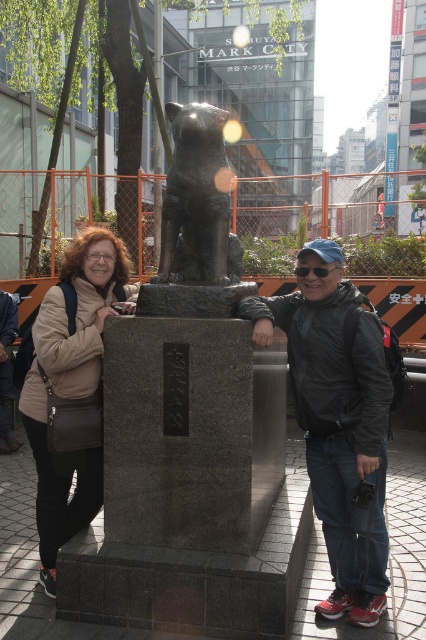
Question: Which point appears closest to the camera in this image?

Choices:
 (A) (40, 368)
 (B) (333, 404)

Answer: (B)

Question: Can you confirm if black matte jacket at right is thinner than transparent plastic goggles at center?

Choices:
 (A) yes
 (B) no

Answer: (B)

Question: Does matte brown leather bag at left have a greater width compared to black polished stone dog at center?

Choices:
 (A) yes
 (B) no

Answer: (B)

Question: Based on their relative distances, which object is farther from the transparent plastic goggles at center?

Choices:
 (A) matte brown leather bag at left
 (B) black matte jacket at right
 (C) black polished stone dog at center
 (D) matte black statue at center

Answer: (A)

Question: Does black polished stone dog at center appear on the right side of transparent plastic goggles at center?

Choices:
 (A) no
 (B) yes

Answer: (A)

Question: Which point is closer to the camera?

Choices:
 (A) pos(187,168)
 (B) pos(55,410)
 (C) pos(334,266)
 (D) pos(308,420)

Answer: (C)